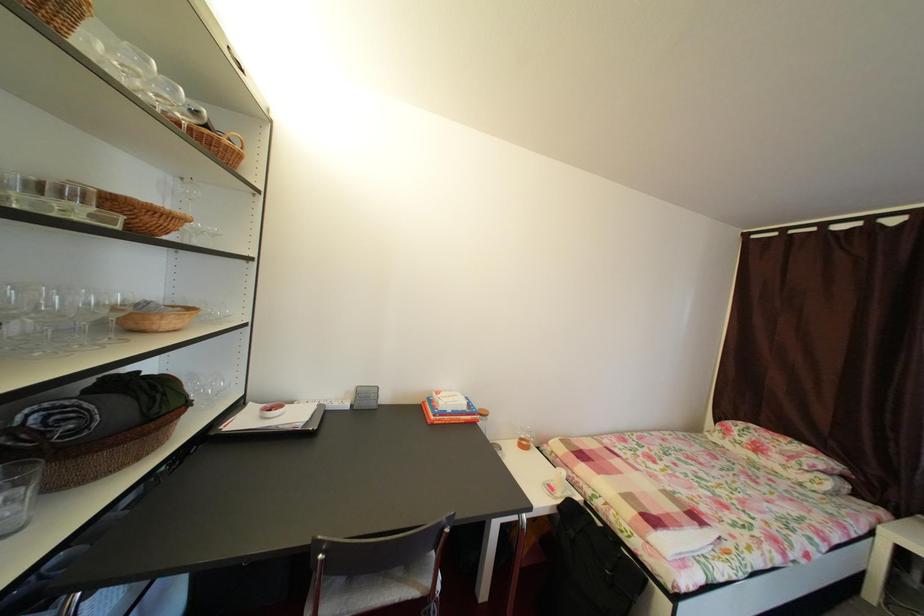
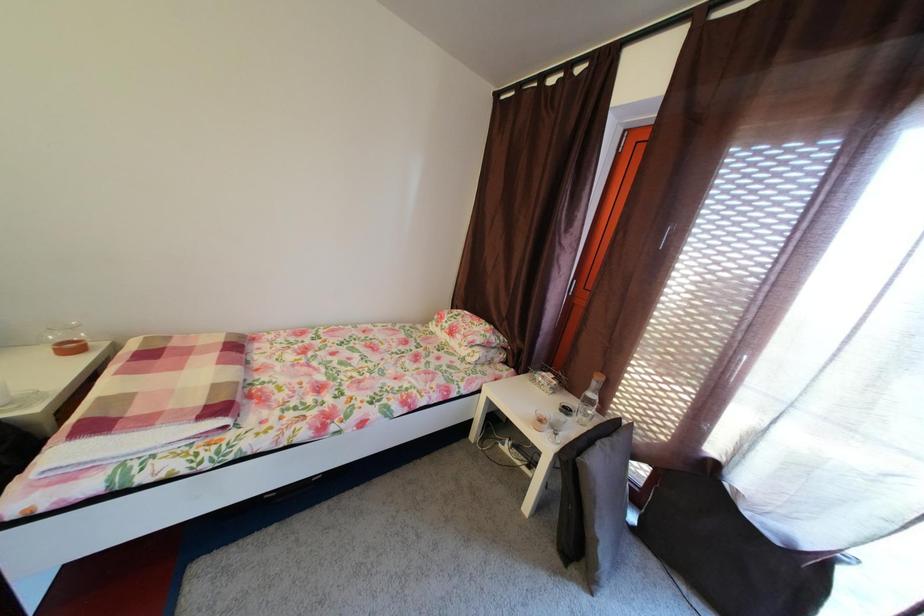
Question: What movement of the cameraman would produce the second image?

Choices:
 (A) Left
 (B) Right
 (C) Forward
 (D) Backward

Answer: (B)